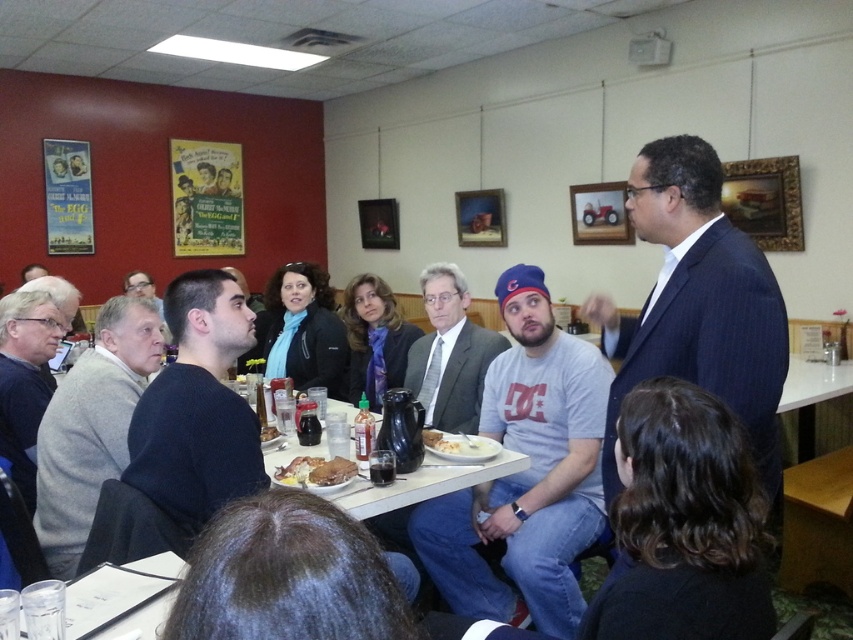
You are sitting at the table and want to look at both points mentioned. Which point is closer to you, point (65, 531) or point (463, 420)?

Point (65, 531) is closer to the viewer than point (463, 420).